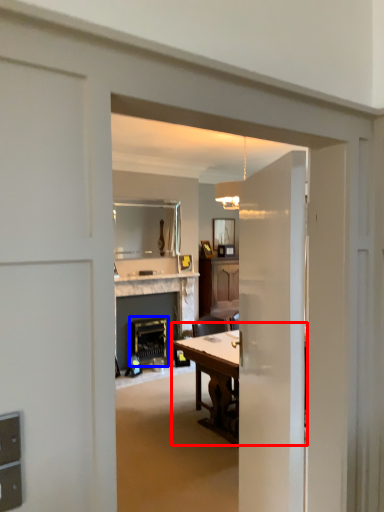
Question: Which object appears farthest to the camera in this image, table (highlighted by a red box) or appliance (highlighted by a blue box)?

Choices:
 (A) table
 (B) appliance

Answer: (B)